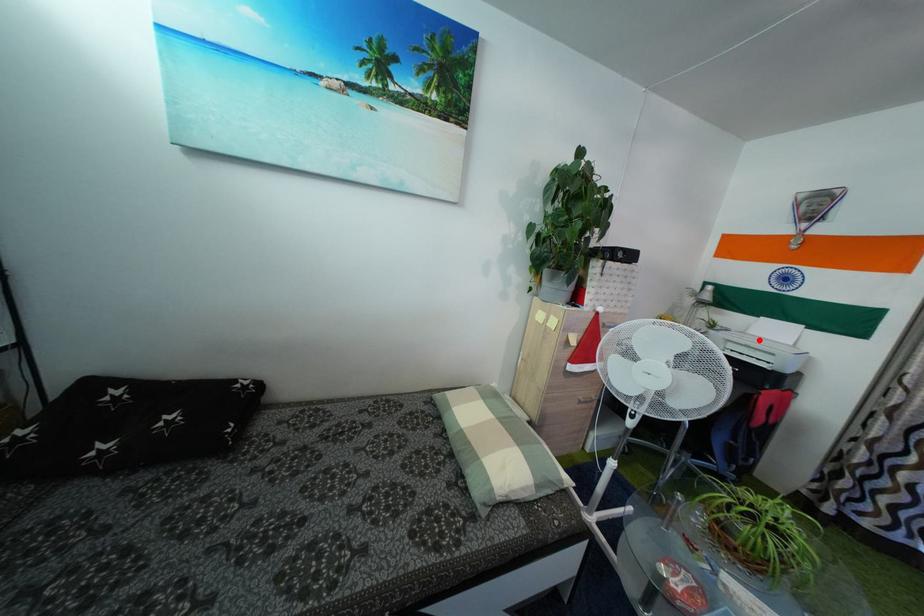
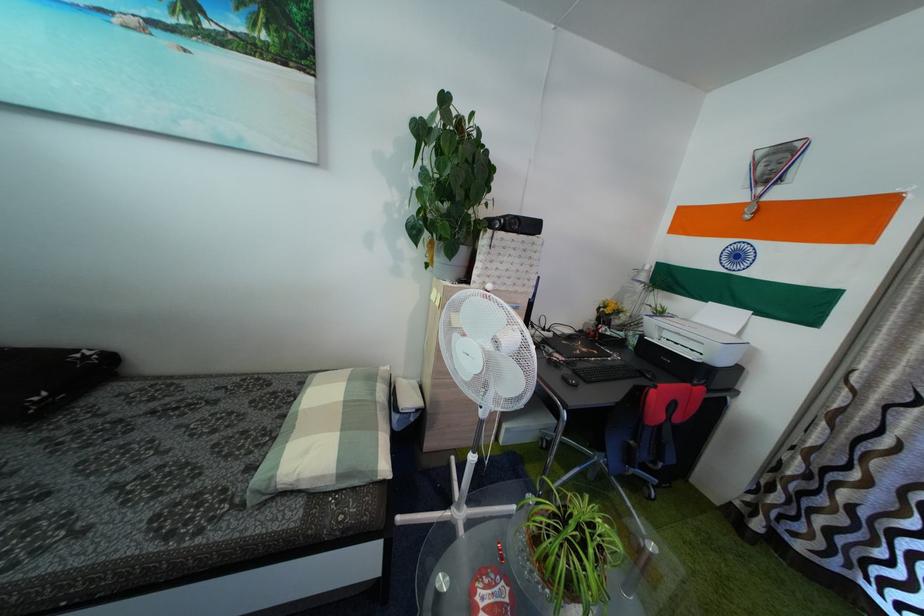
Where in the second image is the point corresponding to the highlighted location from the first image?

(703, 328)